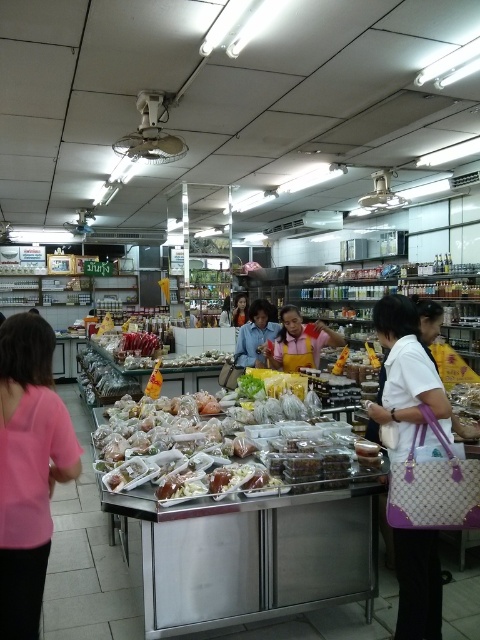
You are shopping in the market and see the pink fabric shirt at left and the blue fabric shirt at center. Which shirt is nearer to you?

The pink fabric shirt at left is closer to the viewer than the blue fabric shirt at center, so the pink fabric shirt at left is nearer to you.

You are a customer looking at the counter and see both the yellow fabric apron at center and the yellow fabric shirt at center. Which one is shorter in height?

The yellow fabric apron at center is not as tall as the yellow fabric shirt at center, so the apron is shorter in height.